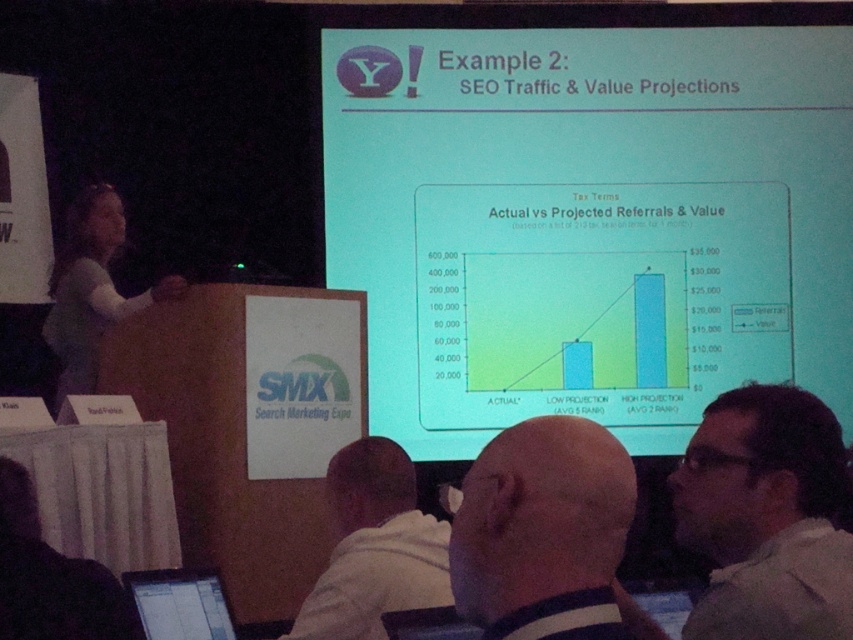
You are an attendee at the SMX Search Marketing Expo. You notice two people in the front row. One has dark brown hair at upper right and another has a white fabric shirt at lower center. Which person is positioned to the right side of the other?

The dark brown hair at upper right is to the right of the white fabric shirt at lower center.

You are an attendee at the SMX Search Marketing Expo. You want to take a photo of the dark brown hair at upper right without blocking the green matte projector screen at upper center in the background. Is this possible?

The dark brown hair at upper right is behind the green matte projector screen at upper center, so you can take the photo without blocking the screen as the hair is already positioned behind it.